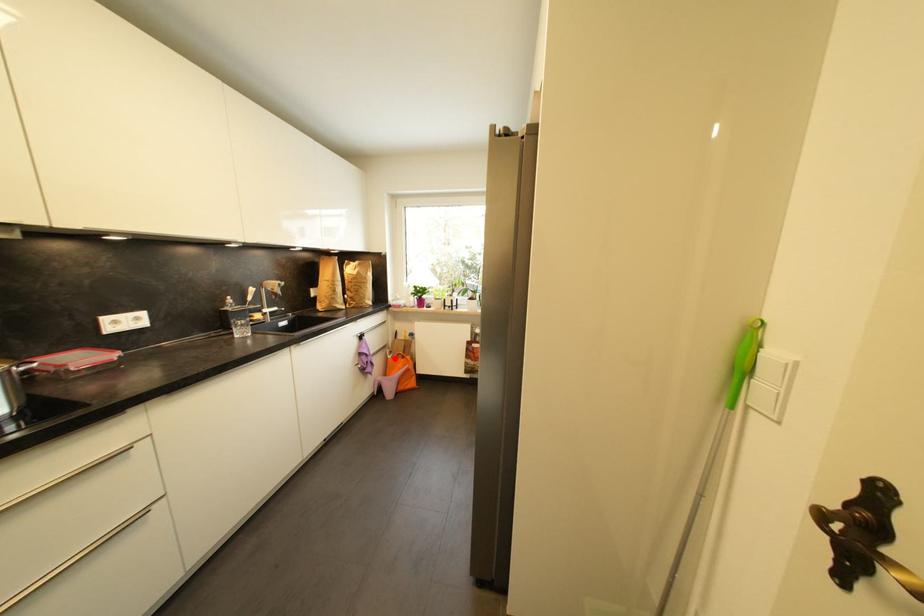
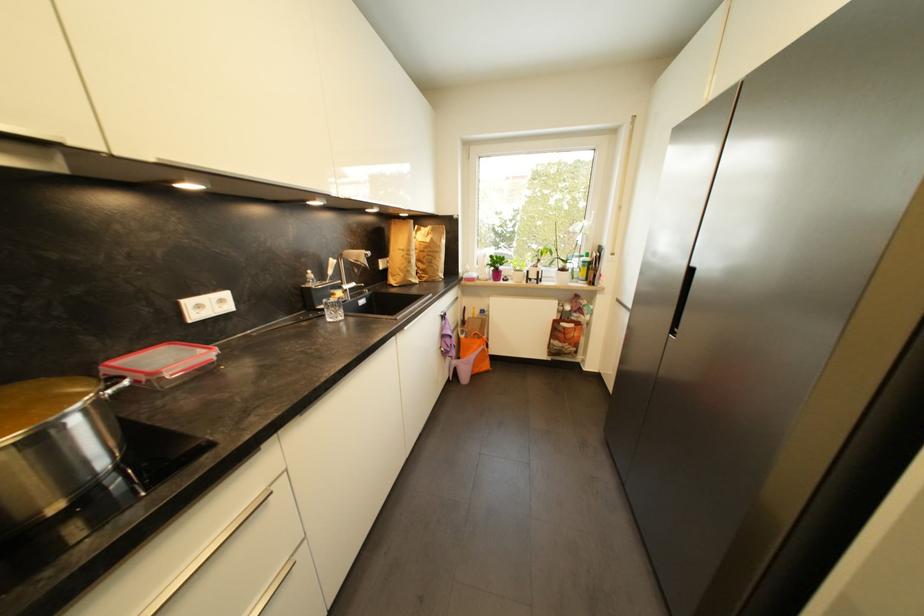
Question: A red point is marked in image1. In image2, is the corresponding 3D point closer to the camera or farther? Reply with the corresponding letter.

Choices:
 (A) The corresponding 3D point is closer.
 (B) The corresponding 3D point is farther.

Answer: (A)